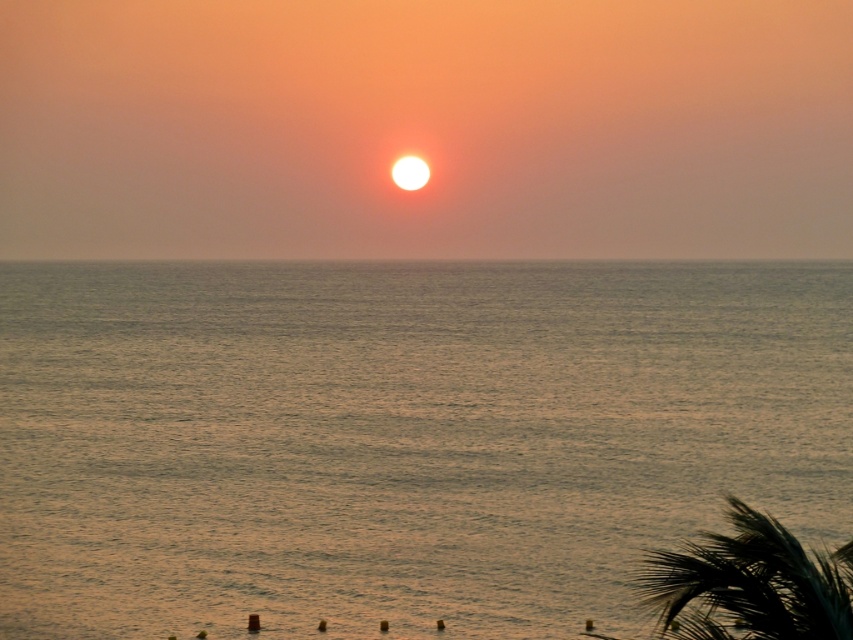
Is point (51, 512) positioned in front of point (664, 573)?

That is False.

Is silvery water at center thinner than dark green leafy palm tree at lower right?

No.

The width and height of the screenshot is (853, 640). What do you see at coordinates (399, 438) in the screenshot?
I see `silvery water at center` at bounding box center [399, 438].

The image size is (853, 640). What are the coordinates of `silvery water at center` in the screenshot? It's located at (399, 438).